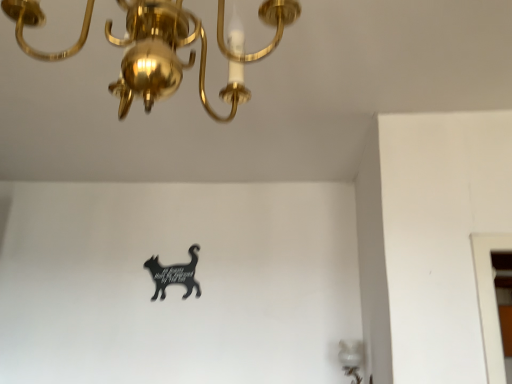
The image size is (512, 384). Describe the element at coordinates (174, 275) in the screenshot. I see `black acrylic cat at center` at that location.

Measure the distance between point (148, 261) and camera.

They are 8.87 feet apart.

At what (x,y) coordinates should I click in order to perform the action: click on black acrylic cat at center. Please return your answer as a coordinate pair (x, y). The width and height of the screenshot is (512, 384). Looking at the image, I should click on (174, 275).

In order to click on gold polished chandelier at upper left in this screenshot , I will do `click(162, 56)`.

This screenshot has width=512, height=384. What do you see at coordinates (162, 56) in the screenshot? I see `gold polished chandelier at upper left` at bounding box center [162, 56].

Locate an element on the screen. black acrylic cat at center is located at coordinates (174, 275).

Is black acrylic cat at center at the right side of gold polished chandelier at upper left?

No, black acrylic cat at center is not to the right of gold polished chandelier at upper left.

Considering the relative positions of black acrylic cat at center and gold polished chandelier at upper left in the image provided, is black acrylic cat at center behind gold polished chandelier at upper left?

Yes.

Is point (195, 266) positioned after point (218, 37)?

Yes, it is.

In the scene shown: From the image's perspective, which is below, black acrylic cat at center or gold polished chandelier at upper left?

From the image's view, black acrylic cat at center is below.

From a real-world perspective, is black acrylic cat at center below gold polished chandelier at upper left?

Yes, from a real-world perspective, black acrylic cat at center is below gold polished chandelier at upper left.

Is black acrylic cat at center wider or thinner than gold polished chandelier at upper left?

Clearly, black acrylic cat at center has less width compared to gold polished chandelier at upper left.

Can you confirm if black acrylic cat at center is shorter than gold polished chandelier at upper left?

Correct, black acrylic cat at center is not as tall as gold polished chandelier at upper left.

Between black acrylic cat at center and gold polished chandelier at upper left, which one has smaller size?

With smaller size is black acrylic cat at center.

Is gold polished chandelier at upper left located within black acrylic cat at center?

No, gold polished chandelier at upper left is located outside of black acrylic cat at center.

Is black acrylic cat at center next to gold polished chandelier at upper left and touching it?

No, black acrylic cat at center is not in contact with gold polished chandelier at upper left.

Is black acrylic cat at center oriented towards gold polished chandelier at upper left?

Yes, black acrylic cat at center faces towards gold polished chandelier at upper left.

What's the angular difference between black acrylic cat at center and gold polished chandelier at upper left's facing directions?

178 degrees.

Measure the distance between black acrylic cat at center and gold polished chandelier at upper left.

1.80 meters.

Identify the location of lamp to the right of black acrylic cat at center. The width and height of the screenshot is (512, 384). (162, 56).

Does gold polished chandelier at upper left appear on the right side of black acrylic cat at center?

Yes, gold polished chandelier at upper left is to the right of black acrylic cat at center.

Is gold polished chandelier at upper left positioned before black acrylic cat at center?

That is True.

Is point (150, 56) closer to viewer compared to point (165, 276)?

That is True.

From the image's perspective, between gold polished chandelier at upper left and black acrylic cat at center, which one is located above?

gold polished chandelier at upper left.

From a real-world perspective, is gold polished chandelier at upper left physically located above or below black acrylic cat at center?

From a real-world perspective, gold polished chandelier at upper left is physically above black acrylic cat at center.

Which of these two, gold polished chandelier at upper left or black acrylic cat at center, is thinner?

black acrylic cat at center.

Does gold polished chandelier at upper left have a greater height compared to black acrylic cat at center?

Yes, gold polished chandelier at upper left is taller than black acrylic cat at center.

Is gold polished chandelier at upper left bigger than black acrylic cat at center?

Indeed, gold polished chandelier at upper left has a larger size compared to black acrylic cat at center.

In the scene shown: Is gold polished chandelier at upper left spatially inside black acrylic cat at center, or outside of it?

→ gold polished chandelier at upper left exists outside the volume of black acrylic cat at center.

Are gold polished chandelier at upper left and black acrylic cat at center far apart?

That's right, there is a large distance between gold polished chandelier at upper left and black acrylic cat at center.

Is gold polished chandelier at upper left turned away from black acrylic cat at center?

That's not correct — gold polished chandelier at upper left is not looking away from black acrylic cat at center.

What's the angular difference between gold polished chandelier at upper left and black acrylic cat at center's facing directions?

The angular difference between gold polished chandelier at upper left and black acrylic cat at center is 178 degrees.

Where is `lamp that is above the black acrylic cat at center (from a real-world perspective)`? lamp that is above the black acrylic cat at center (from a real-world perspective) is located at coordinates (162, 56).

The image size is (512, 384). I want to click on animal below the gold polished chandelier at upper left (from the image's perspective), so click(174, 275).

What are the coordinates of `animal behind the gold polished chandelier at upper left` in the screenshot? It's located at (174, 275).